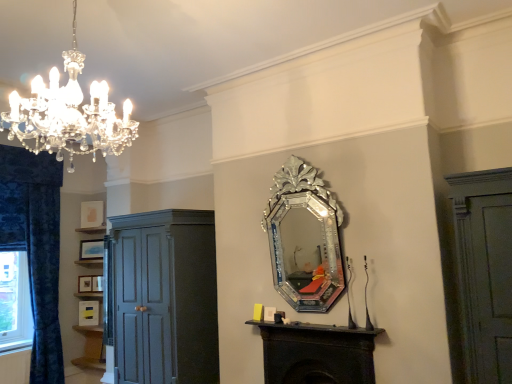
Question: Is matte dark gray cupboard at left facing away from matte gold picture frame at left, placed as the 4th picture frame when sorted from top to bottom?

Choices:
 (A) yes
 (B) no

Answer: (B)

Question: Is matte dark gray cupboard at left bigger than matte gold picture frame at left, marked as the 2th picture frame in a bottom-to-top arrangement?

Choices:
 (A) no
 (B) yes

Answer: (B)

Question: Does matte dark gray cupboard at left have a lesser height compared to matte gold picture frame at left, placed as the 4th picture frame when sorted from top to bottom?

Choices:
 (A) yes
 (B) no

Answer: (B)

Question: Does matte dark gray cupboard at left come behind matte gold picture frame at left, marked as the 2th picture frame in a bottom-to-top arrangement?

Choices:
 (A) yes
 (B) no

Answer: (B)

Question: Is the surface of matte dark gray cupboard at left in direct contact with matte gold picture frame at left, marked as the 2th picture frame in a bottom-to-top arrangement?

Choices:
 (A) no
 (B) yes

Answer: (A)

Question: Is matte gold picture frame at upper left, the first picture frame viewed from the top, inside or outside of silver/glass mirror at center?

Choices:
 (A) outside
 (B) inside

Answer: (A)

Question: Is matte gold picture frame at upper left, which ranks as the fifth picture frame in bottom-to-top order, in front of or behind silver/glass mirror at center in the image?

Choices:
 (A) front
 (B) behind

Answer: (B)

Question: Based on their sizes in the image, would you say matte gold picture frame at upper left, the first picture frame viewed from the top, is bigger or smaller than silver/glass mirror at center?

Choices:
 (A) big
 (B) small

Answer: (B)

Question: From a real-world perspective, is matte gold picture frame at upper left, the first picture frame viewed from the top, above or below silver/glass mirror at center?

Choices:
 (A) below
 (B) above

Answer: (B)

Question: In the image, is matte gold picture frame at left, placed as the 4th picture frame when sorted from top to bottom, positioned in front of or behind matte gold picture frame at upper left, the first picture frame viewed from the top?

Choices:
 (A) front
 (B) behind

Answer: (A)

Question: Is matte gold picture frame at left, marked as the 2th picture frame in a bottom-to-top arrangement, inside or outside of matte gold picture frame at upper left, the first picture frame viewed from the top?

Choices:
 (A) outside
 (B) inside

Answer: (A)

Question: From the image's perspective, is matte gold picture frame at left, marked as the 2th picture frame in a bottom-to-top arrangement, located above or below matte gold picture frame at upper left, the first picture frame viewed from the top?

Choices:
 (A) above
 (B) below

Answer: (B)

Question: From a real-world perspective, is matte gold picture frame at left, marked as the 2th picture frame in a bottom-to-top arrangement, above or below matte gold picture frame at upper left, the first picture frame viewed from the top?

Choices:
 (A) above
 (B) below

Answer: (B)

Question: From their relative heights in the image, would you say blue velvet curtain at left is taller or shorter than silver/glass mirror at center?

Choices:
 (A) tall
 (B) short

Answer: (A)

Question: Considering the positions of point (59, 359) and point (330, 291), is point (59, 359) closer or farther from the camera than point (330, 291)?

Choices:
 (A) closer
 (B) farther

Answer: (B)